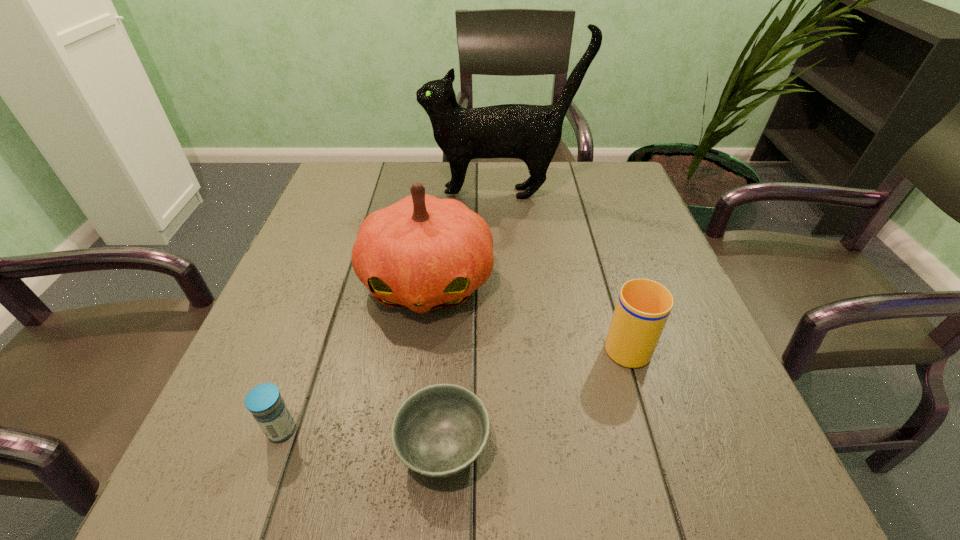
Locate an element on the screen. The width and height of the screenshot is (960, 540). vacant space that satisfies the following two spatial constraints: 1. on the front-facing side of the second tallest object; 2. on the left side of the bowl is located at coordinates (407, 447).

The height and width of the screenshot is (540, 960). In order to click on vacant space that satisfies the following two spatial constraints: 1. on the face of the cat; 2. on the front side of the bowl in this screenshot , I will do `click(517, 447)`.

Locate an element on the screen. The image size is (960, 540). vacant point that satisfies the following two spatial constraints: 1. on the side of the cup with the handle; 2. on the face of the tallest object is located at coordinates (580, 193).